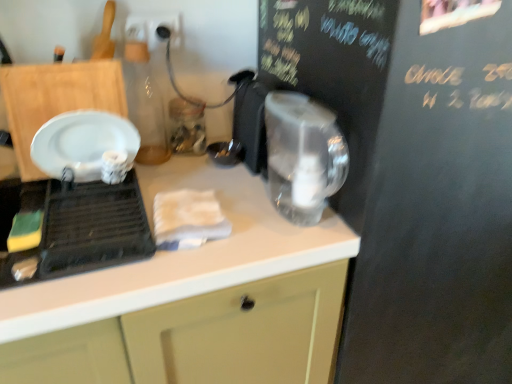
Question: From a real-world perspective, is transparent plastic kettle at center positioned under white matte countertop at center based on gravity?

Choices:
 (A) yes
 (B) no

Answer: (B)

Question: Is transparent plastic kettle at center touching white matte countertop at center?

Choices:
 (A) yes
 (B) no

Answer: (B)

Question: Does transparent plastic kettle at center come behind white matte countertop at center?

Choices:
 (A) no
 (B) yes

Answer: (B)

Question: Does transparent plastic kettle at center have a greater height compared to white matte countertop at center?

Choices:
 (A) yes
 (B) no

Answer: (B)

Question: From a real-world perspective, is transparent plastic kettle at center over white matte countertop at center?

Choices:
 (A) no
 (B) yes

Answer: (B)

Question: Is white matte countertop at center to the left or to the right of black chalkboard at upper right in the image?

Choices:
 (A) right
 (B) left

Answer: (B)

Question: From their relative heights in the image, would you say white matte countertop at center is taller or shorter than black chalkboard at upper right?

Choices:
 (A) short
 (B) tall

Answer: (A)

Question: Does point (262, 213) appear closer or farther from the camera than point (450, 57)?

Choices:
 (A) farther
 (B) closer

Answer: (A)

Question: From a real-world perspective, is white matte countertop at center physically located above or below black chalkboard at upper right?

Choices:
 (A) above
 (B) below

Answer: (B)

Question: From their relative heights in the image, would you say black chalkboard at upper right is taller or shorter than white matte countertop at center?

Choices:
 (A) short
 (B) tall

Answer: (B)

Question: From a real-world perspective, is black chalkboard at upper right physically located above or below white matte countertop at center?

Choices:
 (A) above
 (B) below

Answer: (A)

Question: From the image's perspective, relative to white matte countertop at center, is black chalkboard at upper right above or below?

Choices:
 (A) above
 (B) below

Answer: (A)

Question: Is black chalkboard at upper right spatially inside white matte countertop at center, or outside of it?

Choices:
 (A) inside
 (B) outside

Answer: (B)

Question: Visually, is white glossy plate at left positioned to the left or to the right of transparent plastic kettle at center?

Choices:
 (A) right
 (B) left

Answer: (B)

Question: Is white glossy plate at left spatially inside transparent plastic kettle at center, or outside of it?

Choices:
 (A) outside
 (B) inside

Answer: (A)